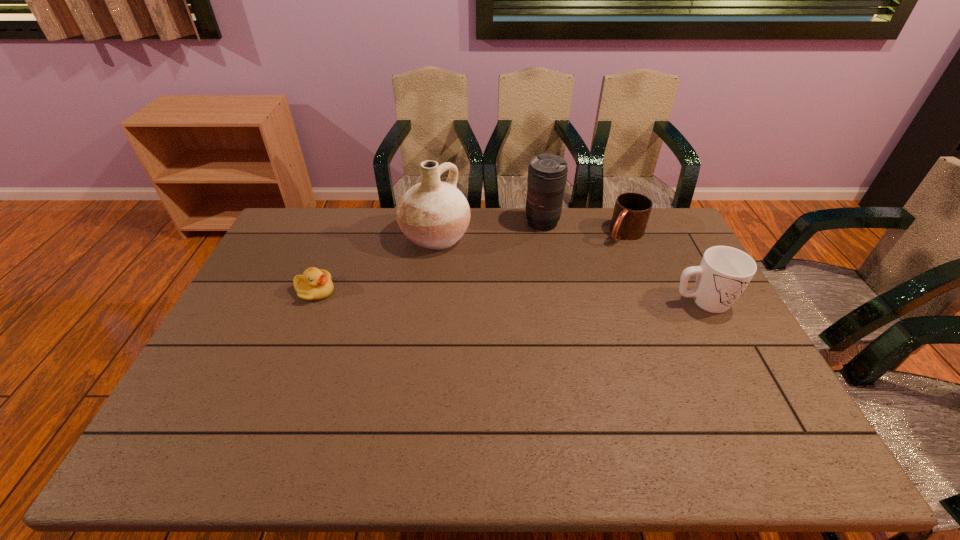
Point out which object is positioned as the second nearest to the taller mug. Please provide its 2D coordinates. Your answer should be formatted as a tuple, i.e. [(x, y)], where the tuple contains the x and y coordinates of a point satisfying the conditions above.

[(547, 173)]

The height and width of the screenshot is (540, 960). What are the coordinates of `object that stands as the fourth closest to the second object from left to right` in the screenshot? It's located at (724, 272).

Identify the location of free space that satisfies the following two spatial constraints: 1. on the back side of the second object from left to right; 2. on the right side of the second shortest object. The height and width of the screenshot is (540, 960). (436, 233).